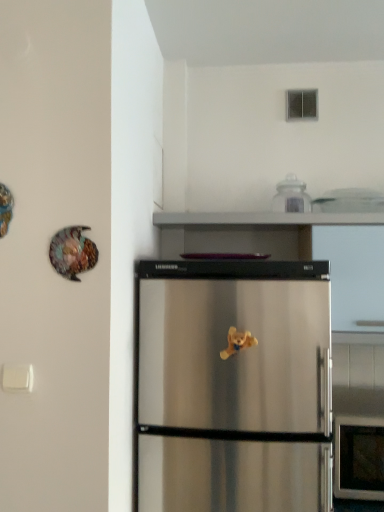
Question: Is yellow plush bear at center located outside shiny metallic plate at upper left?

Choices:
 (A) yes
 (B) no

Answer: (A)

Question: Is yellow plush bear at center bigger than shiny metallic plate at upper left?

Choices:
 (A) no
 (B) yes

Answer: (A)

Question: From the image's perspective, is yellow plush bear at center on top of shiny metallic plate at upper left?

Choices:
 (A) yes
 (B) no

Answer: (B)

Question: Is there a large distance between yellow plush bear at center and shiny metallic plate at upper left?

Choices:
 (A) no
 (B) yes

Answer: (A)

Question: Does yellow plush bear at center have a greater height compared to shiny metallic plate at upper left?

Choices:
 (A) no
 (B) yes

Answer: (A)

Question: Can shiny metallic plate at upper left be found inside yellow plush bear at center?

Choices:
 (A) yes
 (B) no

Answer: (B)

Question: Is yellow plush bear at center wider than clear glass jar at upper center?

Choices:
 (A) yes
 (B) no

Answer: (B)

Question: Can you see yellow plush bear at center touching clear glass jar at upper center?

Choices:
 (A) yes
 (B) no

Answer: (B)

Question: Is yellow plush bear at center taller than clear glass jar at upper center?

Choices:
 (A) no
 (B) yes

Answer: (A)

Question: Is yellow plush bear at center positioned with its back to clear glass jar at upper center?

Choices:
 (A) yes
 (B) no

Answer: (B)

Question: Does yellow plush bear at center have a lesser height compared to clear glass jar at upper center?

Choices:
 (A) yes
 (B) no

Answer: (A)

Question: From the image's perspective, would you say yellow plush bear at center is shown under clear glass jar at upper center?

Choices:
 (A) yes
 (B) no

Answer: (A)

Question: Is the position of clear glass jar at upper center more distant than that of shiny metallic plate at upper left?

Choices:
 (A) yes
 (B) no

Answer: (A)